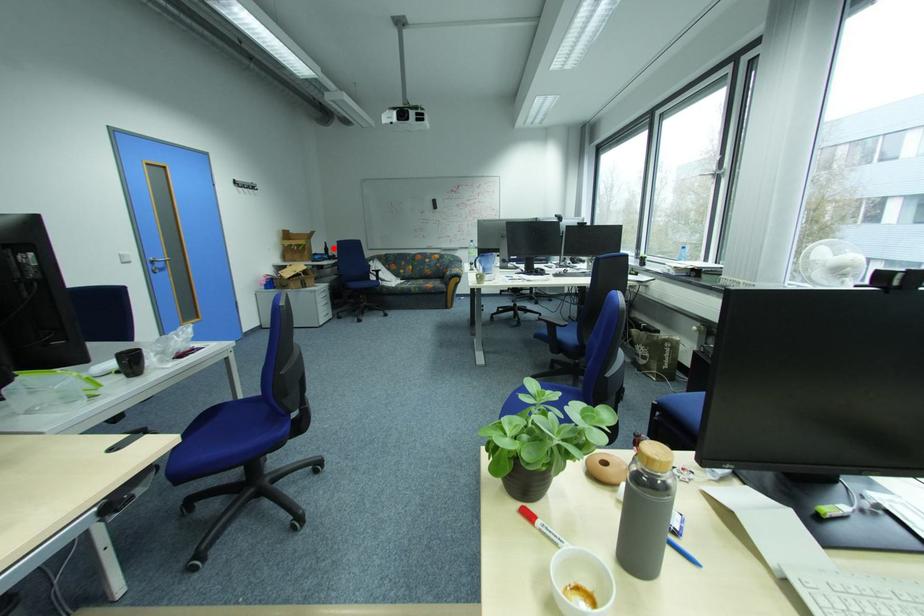
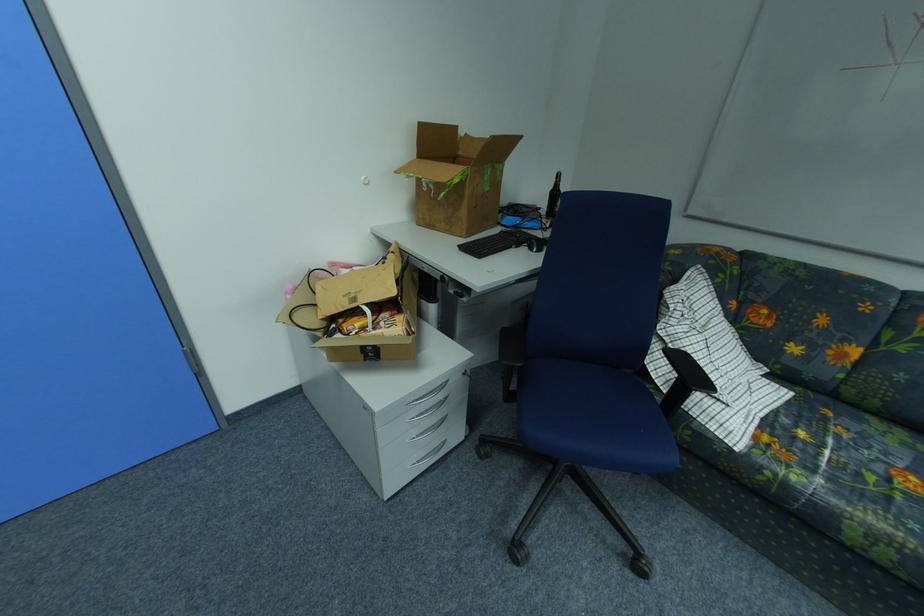
Find the pixel in the second image that matches the highlighted location in the first image.

(560, 188)